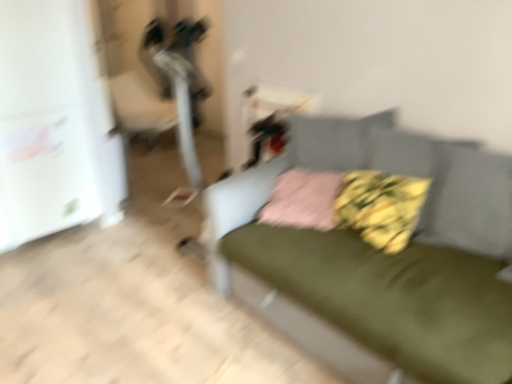
Question: Can you confirm if green fabric couch at center is taller than pink fabric pillow at center, which is the 2th pillow from right to left?

Choices:
 (A) yes
 (B) no

Answer: (A)

Question: Does green fabric couch at center have a smaller size compared to pink fabric pillow at center, which is the 2th pillow from right to left?

Choices:
 (A) no
 (B) yes

Answer: (A)

Question: Is green fabric couch at center shorter than pink fabric pillow at center, which is the 2th pillow from right to left?

Choices:
 (A) yes
 (B) no

Answer: (B)

Question: Considering the relative sizes of green fabric couch at center and pink fabric pillow at center, which is the 2th pillow from right to left, in the image provided, is green fabric couch at center bigger than pink fabric pillow at center, which is the 2th pillow from right to left,?

Choices:
 (A) no
 (B) yes

Answer: (B)

Question: Is green fabric couch at center closer to camera compared to pink fabric pillow at center, acting as the first pillow starting from the left?

Choices:
 (A) no
 (B) yes

Answer: (B)

Question: Is green fabric couch at center in front of or behind pink fabric pillow at center, acting as the first pillow starting from the left, in the image?

Choices:
 (A) behind
 (B) front

Answer: (B)

Question: From the image's perspective, is green fabric couch at center above or below pink fabric pillow at center, which is the 2th pillow from right to left?

Choices:
 (A) below
 (B) above

Answer: (A)

Question: Is green fabric couch at center inside the boundaries of pink fabric pillow at center, acting as the first pillow starting from the left, or outside?

Choices:
 (A) outside
 (B) inside

Answer: (A)

Question: In terms of height, does green fabric couch at center look taller or shorter compared to pink fabric pillow at center, which is the 2th pillow from right to left?

Choices:
 (A) short
 (B) tall

Answer: (B)

Question: Considering their positions, is green fabric couch at center located in front of or behind fluffy yellow pillow at center, which is the 2th pillow in left-to-right order?

Choices:
 (A) behind
 (B) front

Answer: (B)

Question: Is point (330, 140) positioned closer to the camera than point (362, 203)?

Choices:
 (A) closer
 (B) farther

Answer: (B)

Question: Is green fabric couch at center wider or thinner than fluffy yellow pillow at center, which is the first pillow in right-to-left order?

Choices:
 (A) thin
 (B) wide

Answer: (B)

Question: Considering the positions of green fabric couch at center and fluffy yellow pillow at center, which is the 2th pillow in left-to-right order, in the image, is green fabric couch at center taller or shorter than fluffy yellow pillow at center, which is the 2th pillow in left-to-right order,?

Choices:
 (A) tall
 (B) short

Answer: (A)

Question: Is fluffy yellow pillow at center, which is the 2th pillow in left-to-right order, bigger or smaller than green fabric couch at center?

Choices:
 (A) big
 (B) small

Answer: (B)

Question: From their relative heights in the image, would you say fluffy yellow pillow at center, which is the 2th pillow in left-to-right order, is taller or shorter than green fabric couch at center?

Choices:
 (A) short
 (B) tall

Answer: (A)